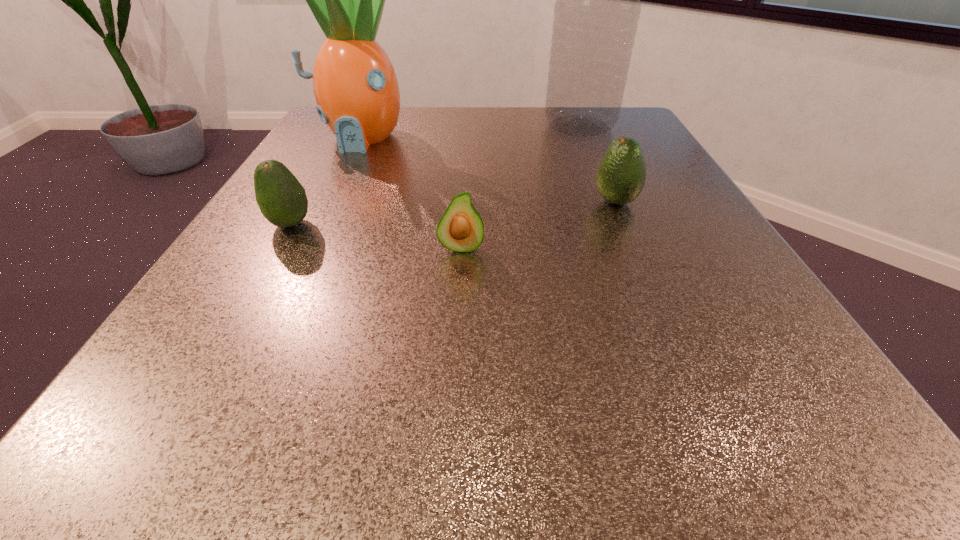
The height and width of the screenshot is (540, 960). I want to click on free space at the near edge, so click(592, 415).

Where is `vacant space at the left edge of the desktop`? vacant space at the left edge of the desktop is located at coordinates (273, 271).

This screenshot has height=540, width=960. Find the location of `vacant position at the right edge of the desktop`. vacant position at the right edge of the desktop is located at coordinates (722, 368).

Where is `free spot at the far right corner of the desktop`? free spot at the far right corner of the desktop is located at coordinates (643, 130).

At what (x,y) coordinates should I click in order to perform the action: click on free space that is in between the nearest object and the fourth shortest object. Please return your answer as a coordinate pair (x, y). The width and height of the screenshot is (960, 540). Looking at the image, I should click on (410, 193).

This screenshot has height=540, width=960. I want to click on vacant space that is in between the tallest object and the leftmost avocado, so click(x=435, y=175).

Locate an element on the screen. Image resolution: width=960 pixels, height=540 pixels. vacant region between the rightmost avocado and the nearest avocado is located at coordinates (539, 225).

This screenshot has width=960, height=540. Identify the location of vacant space that's between the rightmost avocado and the water jug. (597, 164).

Locate an element on the screen. The image size is (960, 540). free space between the leftmost avocado and the third object from right to left is located at coordinates (375, 236).

Find the location of `vacant region between the fourth shortest object and the rightmost avocado`. vacant region between the fourth shortest object and the rightmost avocado is located at coordinates (488, 170).